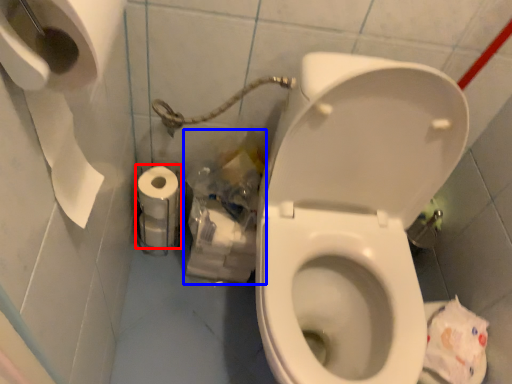
Question: Which of the following is the farthest to the observer, toilet paper (highlighted by a red box) or garbage (highlighted by a blue box)?

Choices:
 (A) toilet paper
 (B) garbage

Answer: (A)